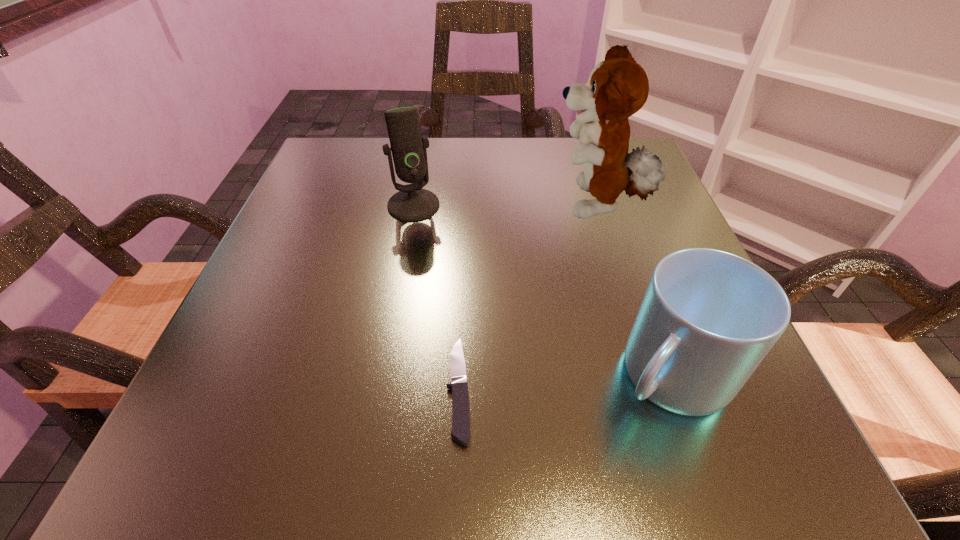
In the image, there is a desktop. Where is `free space at the far edge`? free space at the far edge is located at coordinates (462, 149).

Locate an element on the screen. The width and height of the screenshot is (960, 540). blank space at the left edge of the desktop is located at coordinates (312, 364).

Image resolution: width=960 pixels, height=540 pixels. I want to click on blank space at the right edge of the desktop, so click(598, 231).

This screenshot has width=960, height=540. In order to click on free space at the far left corner of the desktop in this screenshot , I will do `click(337, 157)`.

At what (x,y) coordinates should I click in order to perform the action: click on vacant space at the near left corner. Please return your answer as a coordinate pair (x, y). Looking at the image, I should click on (205, 431).

The height and width of the screenshot is (540, 960). Identify the location of vacant space at the near right corner of the desktop. (766, 453).

Find the location of a particular element. This screenshot has width=960, height=540. vacant space in between the mug and the leftmost object is located at coordinates (541, 291).

This screenshot has height=540, width=960. In order to click on free space between the mug and the tallest object in this screenshot , I will do `click(633, 291)`.

In order to click on empty location between the third object from right to left and the puppy in this screenshot , I will do `click(527, 298)`.

Where is `free space between the mug and the steak knife`? The height and width of the screenshot is (540, 960). free space between the mug and the steak knife is located at coordinates (564, 382).